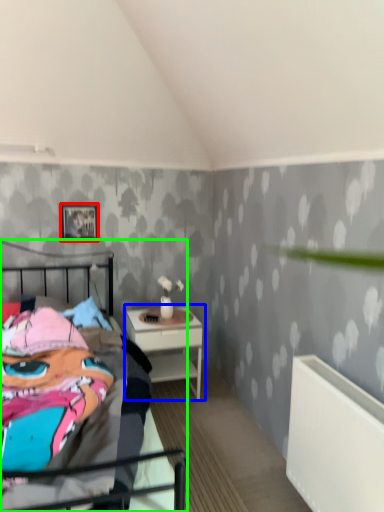
Question: Estimate the real-world distances between objects in this image. Which object is closer to picture frame (highlighted by a red box), nightstand (highlighted by a blue box) or bed (highlighted by a green box)?

Choices:
 (A) nightstand
 (B) bed

Answer: (A)